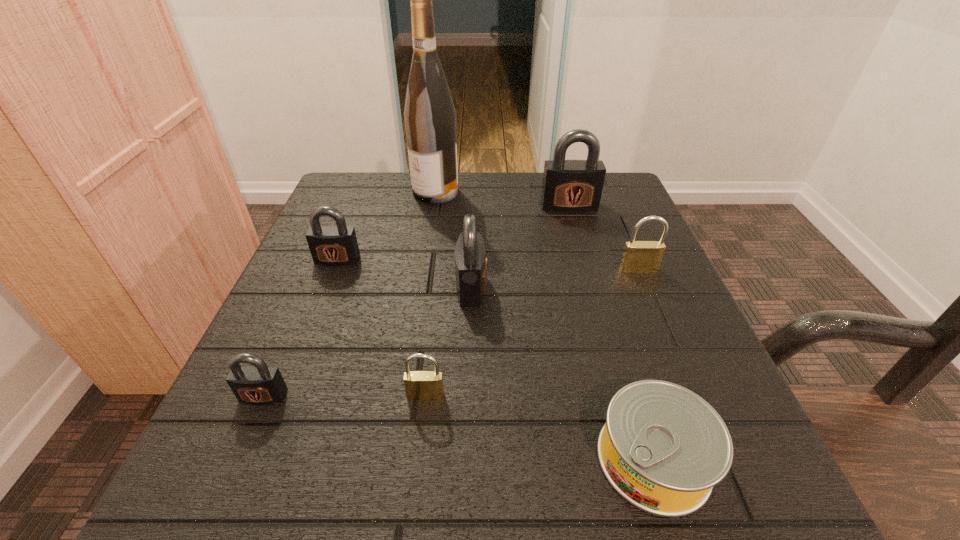
At what (x,y) coordinates should I click in order to perform the action: click on vacant space located 0.100m on the back of the nearest object. Please return your answer as a coordinate pair (x, y). Image resolution: width=960 pixels, height=540 pixels. Looking at the image, I should click on [621, 353].

At what (x,y) coordinates should I click in order to perform the action: click on wine bottle positioned at the far edge. Please return your answer as a coordinate pair (x, y). Looking at the image, I should click on (430, 122).

Find the location of a particular element. This screenshot has height=540, width=960. padlock at the far edge is located at coordinates (571, 186).

Image resolution: width=960 pixels, height=540 pixels. Find the location of `object that is positioned at the near edge`. object that is positioned at the near edge is located at coordinates (663, 448).

Where is `can that is at the right edge`? This screenshot has width=960, height=540. can that is at the right edge is located at coordinates (663, 448).

Image resolution: width=960 pixels, height=540 pixels. Find the location of `object situated at the far right corner`. object situated at the far right corner is located at coordinates pos(571,186).

Where is `object positioned at the near right corner`? object positioned at the near right corner is located at coordinates (663, 448).

In the image, there is a desktop. Where is `free space at the far edge`? The image size is (960, 540). free space at the far edge is located at coordinates (536, 171).

This screenshot has height=540, width=960. In the image, there is a desktop. What are the coordinates of `vacant space at the near edge` in the screenshot? It's located at (393, 456).

Locate an element on the screen. This screenshot has width=960, height=540. free space at the left edge is located at coordinates (315, 336).